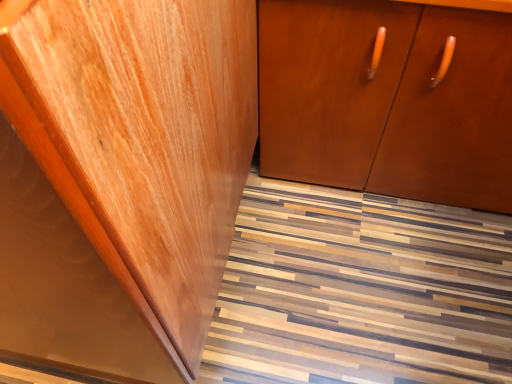
What is the approximate height of matte brown cabinet at center, which ranks as the 2th cabinetry in left-to-right order?

The height of matte brown cabinet at center, which ranks as the 2th cabinetry in left-to-right order, is 23.56 inches.

What do you see at coordinates (121, 178) in the screenshot? I see `glossy wood cabinet at left, which appears as the 1th cabinetry when viewed from the left` at bounding box center [121, 178].

You are a GUI agent. You are given a task and a screenshot of the screen. Output one action in this format:
    pyautogui.click(x=<x>, y=<y>)
    Task: Click on the glossy wood cabinet at left, which appears as the 1th cabinetry when viewed from the left
    This screenshot has width=512, height=384.
    Given the screenshot: What is the action you would take?
    coord(121,178)

Describe the element at coordinates (361, 291) in the screenshot. I see `wooden floor at lower center` at that location.

The width and height of the screenshot is (512, 384). I want to click on matte brown cabinet at center, which ranks as the 2th cabinetry in left-to-right order, so click(388, 99).

Does wooden floor at lower center turn towards glossy wood cabinet at left, which appears as the 1th cabinetry when viewed from the left?

No, wooden floor at lower center is not facing towards glossy wood cabinet at left, which appears as the 1th cabinetry when viewed from the left.

In terms of height, does wooden floor at lower center look taller or shorter compared to glossy wood cabinet at left, which is the 2th cabinetry from right to left?

Clearly, wooden floor at lower center is shorter compared to glossy wood cabinet at left, which is the 2th cabinetry from right to left.

Considering the relative positions of wooden floor at lower center and glossy wood cabinet at left, which appears as the 1th cabinetry when viewed from the left, in the image provided, is wooden floor at lower center to the right of glossy wood cabinet at left, which appears as the 1th cabinetry when viewed from the left, from the viewer's perspective?

Yes.

From the picture: From a real-world perspective, is wooden floor at lower center physically below glossy wood cabinet at left, which appears as the 1th cabinetry when viewed from the left?

Yes, from a real-world perspective, wooden floor at lower center is under glossy wood cabinet at left, which appears as the 1th cabinetry when viewed from the left.

Considering the positions of objects matte brown cabinet at center, acting as the first cabinetry starting from the right, and glossy wood cabinet at left, which appears as the 1th cabinetry when viewed from the left, in the image provided, who is behind, matte brown cabinet at center, acting as the first cabinetry starting from the right, or glossy wood cabinet at left, which appears as the 1th cabinetry when viewed from the left,?

matte brown cabinet at center, acting as the first cabinetry starting from the right, is behind.

Considering the sizes of objects matte brown cabinet at center, acting as the first cabinetry starting from the right, and glossy wood cabinet at left, which appears as the 1th cabinetry when viewed from the left, in the image provided, who is wider, matte brown cabinet at center, acting as the first cabinetry starting from the right, or glossy wood cabinet at left, which appears as the 1th cabinetry when viewed from the left,?

With larger width is matte brown cabinet at center, acting as the first cabinetry starting from the right.

From a real-world perspective, is matte brown cabinet at center, which ranks as the 2th cabinetry in left-to-right order, on top of glossy wood cabinet at left, which appears as the 1th cabinetry when viewed from the left?

No, from a real-world perspective, matte brown cabinet at center, which ranks as the 2th cabinetry in left-to-right order, is not above glossy wood cabinet at left, which appears as the 1th cabinetry when viewed from the left.

What's the angular difference between matte brown cabinet at center, which ranks as the 2th cabinetry in left-to-right order, and glossy wood cabinet at left, which is the 2th cabinetry from right to left,'s facing directions?

There is a 90-degree angle between the facing directions of matte brown cabinet at center, which ranks as the 2th cabinetry in left-to-right order, and glossy wood cabinet at left, which is the 2th cabinetry from right to left.

Can you confirm if glossy wood cabinet at left, which is the 2th cabinetry from right to left, is positioned to the left of matte brown cabinet at center, acting as the first cabinetry starting from the right?

Yes, glossy wood cabinet at left, which is the 2th cabinetry from right to left, is to the left of matte brown cabinet at center, acting as the first cabinetry starting from the right.

What's the angular difference between glossy wood cabinet at left, which is the 2th cabinetry from right to left, and matte brown cabinet at center, which ranks as the 2th cabinetry in left-to-right order,'s facing directions?

The angle between the facing direction of glossy wood cabinet at left, which is the 2th cabinetry from right to left, and the facing direction of matte brown cabinet at center, which ranks as the 2th cabinetry in left-to-right order, is 90 degrees.

Does glossy wood cabinet at left, which is the 2th cabinetry from right to left, have a greater width compared to matte brown cabinet at center, which ranks as the 2th cabinetry in left-to-right order?

No.

From the image's perspective, is glossy wood cabinet at left, which appears as the 1th cabinetry when viewed from the left, located above or below matte brown cabinet at center, which ranks as the 2th cabinetry in left-to-right order?

glossy wood cabinet at left, which appears as the 1th cabinetry when viewed from the left, is below matte brown cabinet at center, which ranks as the 2th cabinetry in left-to-right order.

From a real-world perspective, is glossy wood cabinet at left, which appears as the 1th cabinetry when viewed from the left, located beneath wooden floor at lower center?

No, from a real-world perspective, glossy wood cabinet at left, which appears as the 1th cabinetry when viewed from the left, is not below wooden floor at lower center.

Is glossy wood cabinet at left, which appears as the 1th cabinetry when viewed from the left, located outside wooden floor at lower center?

Indeed, glossy wood cabinet at left, which appears as the 1th cabinetry when viewed from the left, is completely outside wooden floor at lower center.

Considering the relative sizes of glossy wood cabinet at left, which is the 2th cabinetry from right to left, and wooden floor at lower center in the image provided, is glossy wood cabinet at left, which is the 2th cabinetry from right to left, taller than wooden floor at lower center?

Indeed, glossy wood cabinet at left, which is the 2th cabinetry from right to left, has a greater height compared to wooden floor at lower center.

Is glossy wood cabinet at left, which appears as the 1th cabinetry when viewed from the left, closer to the viewer compared to wooden floor at lower center?

Yes, it is.

Is wooden floor at lower center beside matte brown cabinet at center, acting as the first cabinetry starting from the right?

No, wooden floor at lower center is not next to matte brown cabinet at center, acting as the first cabinetry starting from the right.

From a real-world perspective, is wooden floor at lower center physically located above or below matte brown cabinet at center, which ranks as the 2th cabinetry in left-to-right order?

Clearly, from a real-world perspective, wooden floor at lower center is below matte brown cabinet at center, which ranks as the 2th cabinetry in left-to-right order.

Which of these two, wooden floor at lower center or matte brown cabinet at center, acting as the first cabinetry starting from the right, is thinner?

With smaller width is matte brown cabinet at center, acting as the first cabinetry starting from the right.

Looking at the image, does wooden floor at lower center seem bigger or smaller compared to matte brown cabinet at center, which ranks as the 2th cabinetry in left-to-right order?

Clearly, wooden floor at lower center is smaller in size than matte brown cabinet at center, which ranks as the 2th cabinetry in left-to-right order.

From a real-world perspective, which is physically above, matte brown cabinet at center, acting as the first cabinetry starting from the right, or wooden floor at lower center?

From a 3D spatial view, matte brown cabinet at center, acting as the first cabinetry starting from the right, is above.

Which object is positioned more to the left, matte brown cabinet at center, acting as the first cabinetry starting from the right, or wooden floor at lower center?

wooden floor at lower center is more to the left.

In the scene shown: Is matte brown cabinet at center, acting as the first cabinetry starting from the right, spatially inside wooden floor at lower center, or outside of it?

matte brown cabinet at center, acting as the first cabinetry starting from the right, is spatially situated outside wooden floor at lower center.

There is a wooden floor at lower center. At what (x,y) coordinates should I click in order to perform the action: click on the 2nd cabinetry above it (from a real-world perspective). Please return your answer as a coordinate pair (x, y). Image resolution: width=512 pixels, height=384 pixels. Looking at the image, I should click on (121, 178).

Find the location of a particular element. This screenshot has width=512, height=384. cabinetry directly beneath the glossy wood cabinet at left, which appears as the 1th cabinetry when viewed from the left (from a real-world perspective) is located at coordinates (388, 99).

Estimate the real-world distances between objects in this image. Which object is closer to matte brown cabinet at center, which ranks as the 2th cabinetry in left-to-right order, wooden floor at lower center or glossy wood cabinet at left, which is the 2th cabinetry from right to left?

wooden floor at lower center.

Which object lies further to the anchor point glossy wood cabinet at left, which is the 2th cabinetry from right to left, matte brown cabinet at center, acting as the first cabinetry starting from the right, or wooden floor at lower center?

wooden floor at lower center lies further to glossy wood cabinet at left, which is the 2th cabinetry from right to left, than the other object.

Based on their spatial positions, is matte brown cabinet at center, which ranks as the 2th cabinetry in left-to-right order, or glossy wood cabinet at left, which appears as the 1th cabinetry when viewed from the left, further from wooden floor at lower center?

Based on the image, glossy wood cabinet at left, which appears as the 1th cabinetry when viewed from the left, appears to be further to wooden floor at lower center.

Based on their spatial positions, is glossy wood cabinet at left, which appears as the 1th cabinetry when viewed from the left, or wooden floor at lower center closer to matte brown cabinet at center, which ranks as the 2th cabinetry in left-to-right order?

Among the two, wooden floor at lower center is located nearer to matte brown cabinet at center, which ranks as the 2th cabinetry in left-to-right order.

Based on their spatial positions, is glossy wood cabinet at left, which is the 2th cabinetry from right to left, or matte brown cabinet at center, acting as the first cabinetry starting from the right, further from wooden floor at lower center?

The object further to wooden floor at lower center is glossy wood cabinet at left, which is the 2th cabinetry from right to left.

Looking at the image, which one is located closer to glossy wood cabinet at left, which is the 2th cabinetry from right to left, wooden floor at lower center or matte brown cabinet at center, which ranks as the 2th cabinetry in left-to-right order?

Based on the image, matte brown cabinet at center, which ranks as the 2th cabinetry in left-to-right order, appears to be nearer to glossy wood cabinet at left, which is the 2th cabinetry from right to left.

At what (x,y) coordinates should I click in order to perform the action: click on stairwell located between glossy wood cabinet at left, which appears as the 1th cabinetry when viewed from the left, and matte brown cabinet at center, which ranks as the 2th cabinetry in left-to-right order, in the left-right direction. Please return your answer as a coordinate pair (x, y). Looking at the image, I should click on (361, 291).